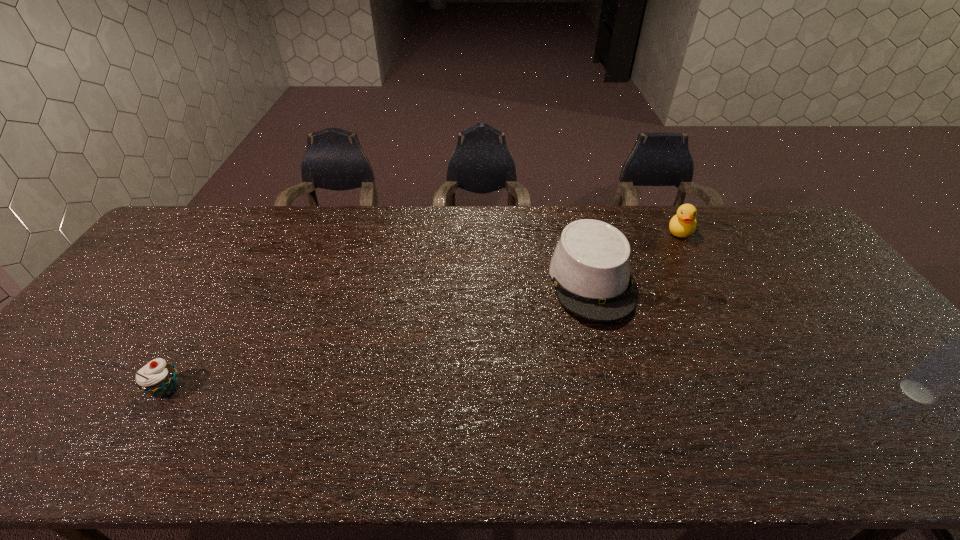
Identify the location of vacant space located 0.210m on the front-facing side of the second object from left to right. This screenshot has width=960, height=540. 625,395.

The width and height of the screenshot is (960, 540). Identify the location of vacant space located 0.230m on the front-facing side of the second object from left to right. (627, 403).

What are the coordinates of `free region located 0.130m on the face of the farthest object` in the screenshot? It's located at (668, 262).

Locate an element on the screen. This screenshot has width=960, height=540. vacant area situated on the face of the farthest object is located at coordinates (656, 288).

Find the location of `vacant space located on the face of the farthest object`. vacant space located on the face of the farthest object is located at coordinates (665, 269).

Identify the location of hat that is at the far edge. (590, 268).

You are a GUI agent. You are given a task and a screenshot of the screen. Output one action in this format:
    pyautogui.click(x=<x>, y=<y>)
    Task: Click on the duckling that is at the far edge
    The width and height of the screenshot is (960, 540).
    Given the screenshot: What is the action you would take?
    pyautogui.click(x=683, y=224)

At what (x,y) coordinates should I click in order to perform the action: click on cupcake that is at the near edge. Please return your answer as a coordinate pair (x, y). The image size is (960, 540). Looking at the image, I should click on (157, 378).

This screenshot has height=540, width=960. What are the coordinates of `water bottle situated at the near edge` in the screenshot? It's located at (958, 360).

At what (x,y) coordinates should I click in order to perform the action: click on object at the right edge. Please return your answer as a coordinate pair (x, y). The height and width of the screenshot is (540, 960). Looking at the image, I should click on (958, 360).